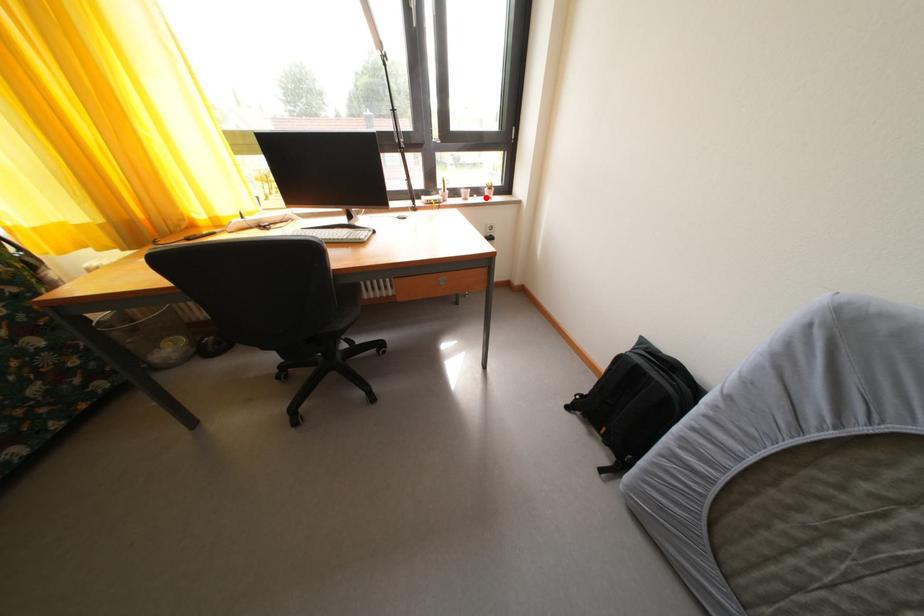
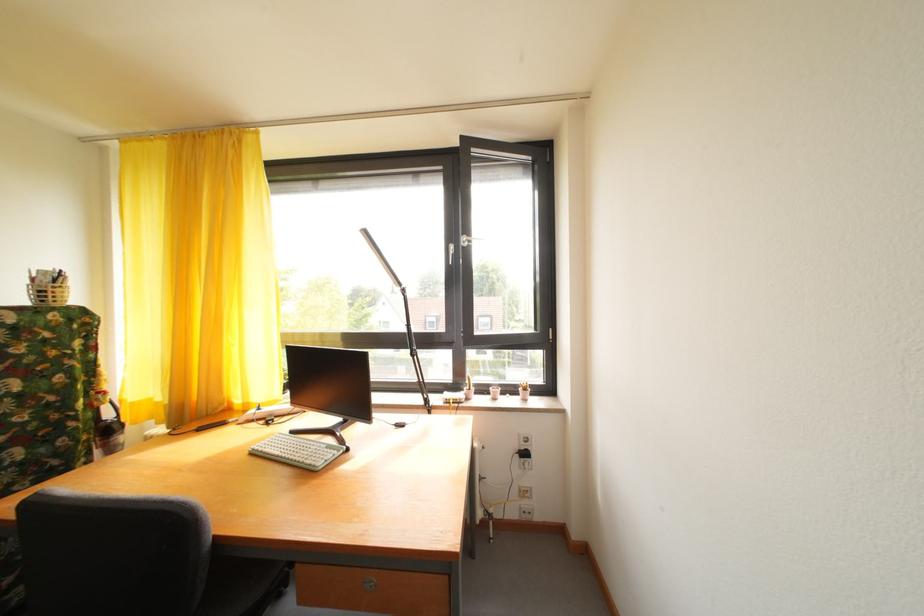
Find the pixel in the second image that matches the highlighted location in the first image.

(520, 395)